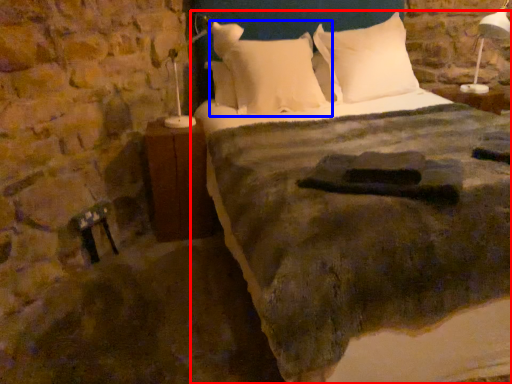
Question: Which object appears farthest to the camera in this image, bed (highlighted by a red box) or pillow (highlighted by a blue box)?

Choices:
 (A) bed
 (B) pillow

Answer: (B)